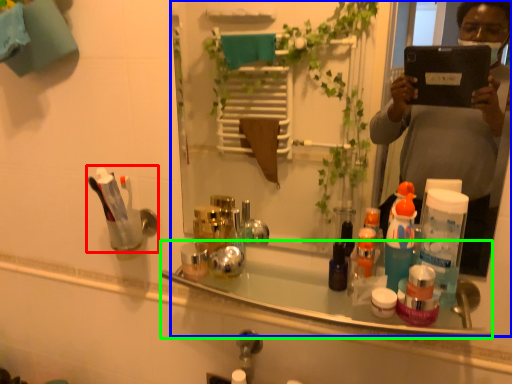
Question: Based on their relative distances, which object is nearer to toiletry (highlighted by a red box)? Choose from mirror (highlighted by a blue box) and bath (highlighted by a green box).

Choices:
 (A) mirror
 (B) bath

Answer: (B)